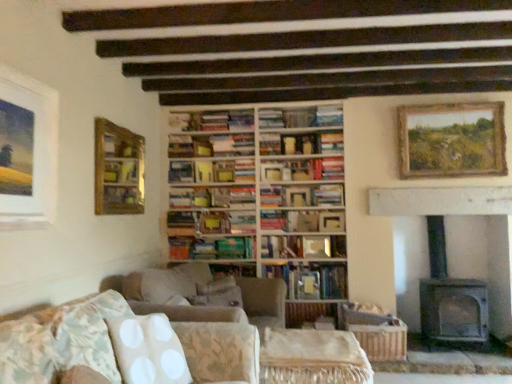
Question: From their relative heights in the image, would you say hardcover book at center, marked as the 2th book in a top-to-bottom arrangement, is taller or shorter than hardcover books at center, placed as the first book when sorted from top to bottom?

Choices:
 (A) tall
 (B) short

Answer: (A)

Question: Looking at their shapes, would you say hardcover book at center, marked as the 2th book in a top-to-bottom arrangement, is wider or thinner than hardcover books at center, the 7th book in the bottom-to-top sequence?

Choices:
 (A) wide
 (B) thin

Answer: (B)

Question: Which is nearer to the wooden bookshelf at upper center?

Choices:
 (A) hardcover books at center, placed as the first book when sorted from top to bottom
 (B) wooden bookshelf at center
 (C) wooden picture frame at center, the 2th picture frame viewed from the left
 (D) beige fabric side table at center
 (E) gray stone fireplace at right

Answer: (A)

Question: Which of these objects is positioned closest to the wooden picture frame at center, which appears as the second picture frame when viewed from the right?

Choices:
 (A) hardcover book at center, the 5th book when ordered from bottom to top
 (B) hardcover book at center, marked as the 4th book in a bottom-to-top arrangement
 (C) green matte book at center, the second book in the bottom-to-top sequence
 (D) hardcover book at center, placed as the 3th book when sorted from bottom to top
 (E) gray stone fireplace at right

Answer: (B)